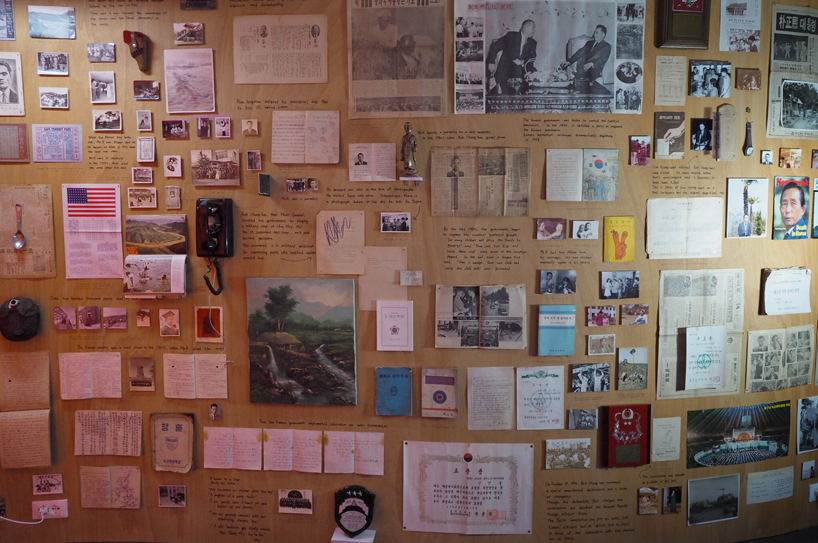
The width and height of the screenshot is (818, 543). Find the location of `plaque`. plaque is located at coordinates (659, 6), (604, 413).